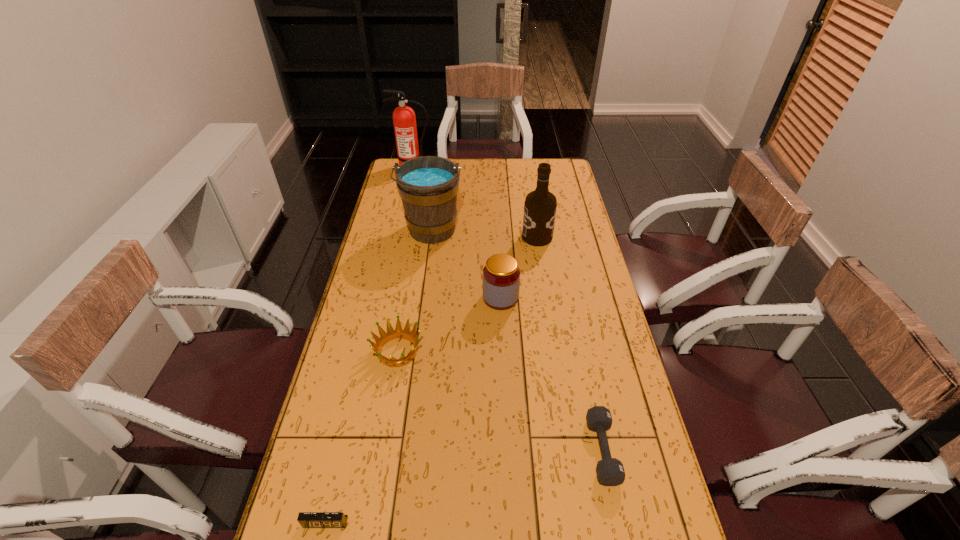
Locate an element on the screen. The width and height of the screenshot is (960, 540). the tallest object is located at coordinates (404, 119).

Where is `the farthest object`? Image resolution: width=960 pixels, height=540 pixels. the farthest object is located at coordinates (404, 119).

Where is `alcohol`? This screenshot has width=960, height=540. alcohol is located at coordinates (540, 206).

Where is `wine bucket`? wine bucket is located at coordinates (428, 185).

The height and width of the screenshot is (540, 960). Identify the location of jar. (501, 275).

Where is `the fourth nearest object`? the fourth nearest object is located at coordinates (501, 275).

The image size is (960, 540). What are the coordinates of `the third nearest object` in the screenshot? It's located at (391, 334).

Locate an element on the screen. The width and height of the screenshot is (960, 540). crown is located at coordinates (391, 334).

I want to click on the second shortest object, so (610, 471).

Find the location of a particular element. The image size is (960, 540). dumbbell is located at coordinates (610, 471).